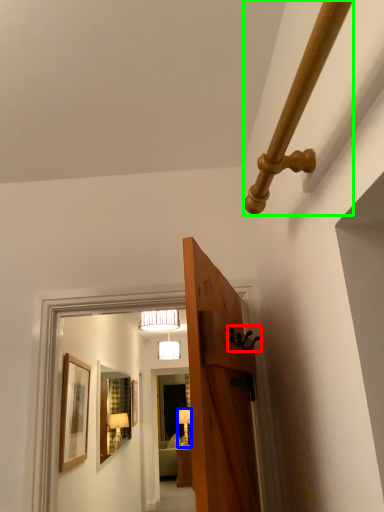
Question: Which object is positioned closest to door handle (highlighted by a red box)? Select from lamp (highlighted by a blue box) and beam (highlighted by a green box).

Choices:
 (A) lamp
 (B) beam

Answer: (B)